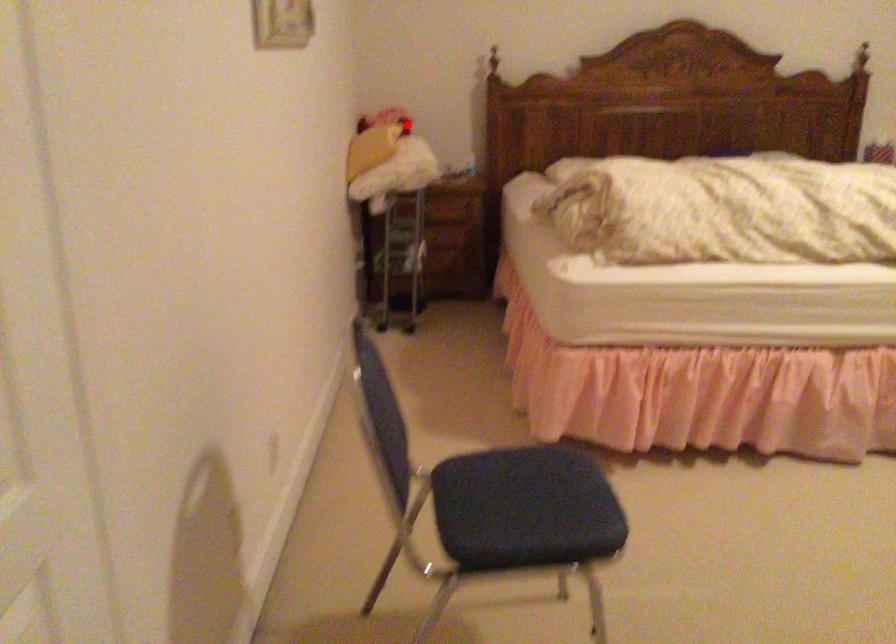
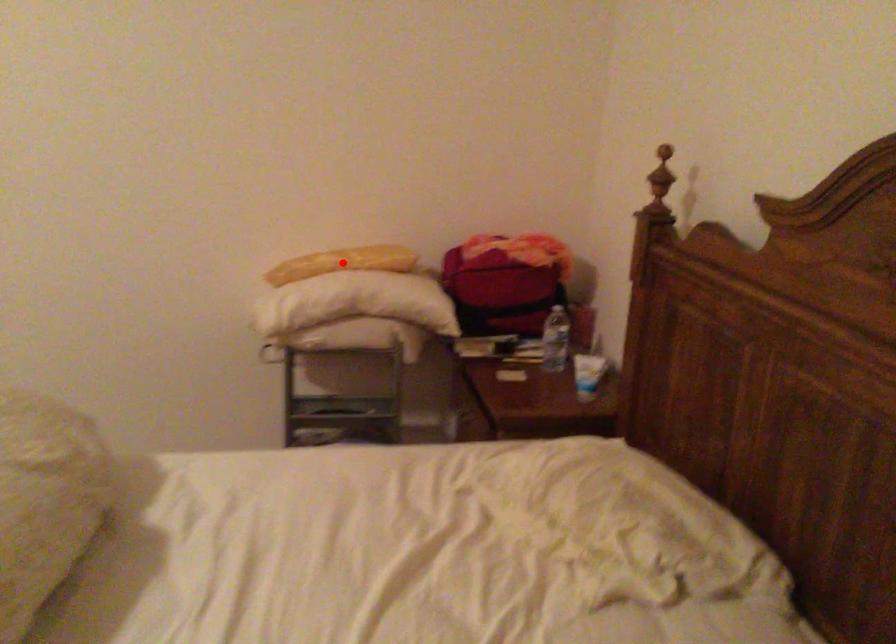
I am providing you with two images of the same scene from different viewpoints. A red point is marked on the first image and another point is marked on the second image. Is the red point in image1 aligned with the point shown in image2?

No